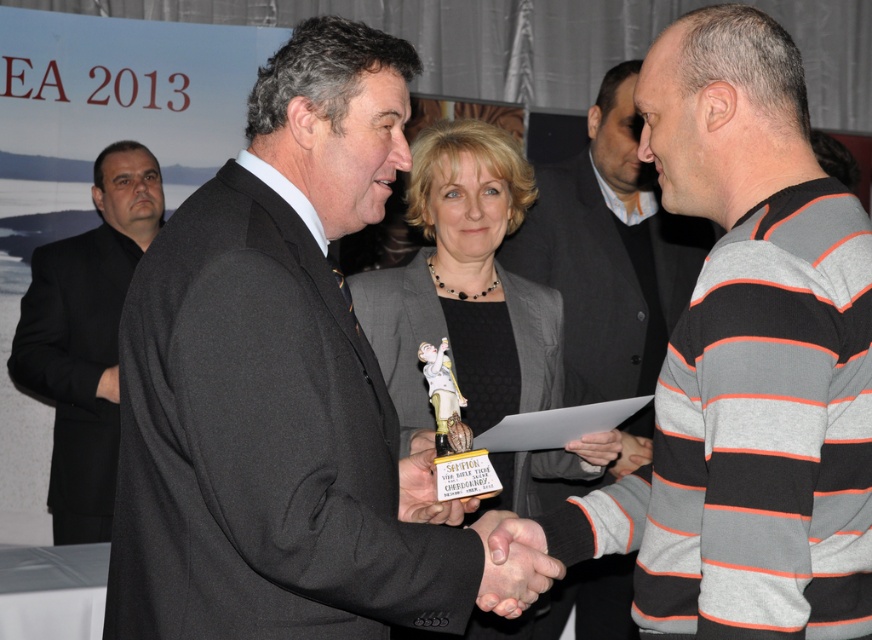
You are an event organizer who needs to ensure all attendees have enough space to move comfortably. You observe the black matte suit at left and the matte gray sweater at center. Which attendee should you ask to move slightly to the right to create more space between them?

The black matte suit at left is wider than the matte gray sweater at center, so you should ask the attendee wearing the black matte suit at left to move slightly to the right to create more space between them.

You are an attendee at the event and want to take a photo of the metallic gold trophy at center and the matte gray sweater at center. Which object should you focus on first to ensure both are in clear focus?

You should focus on the metallic gold trophy at center first because it is closer to the viewer than the matte gray sweater at center, so adjusting focus from near to far will help both be in clear focus.